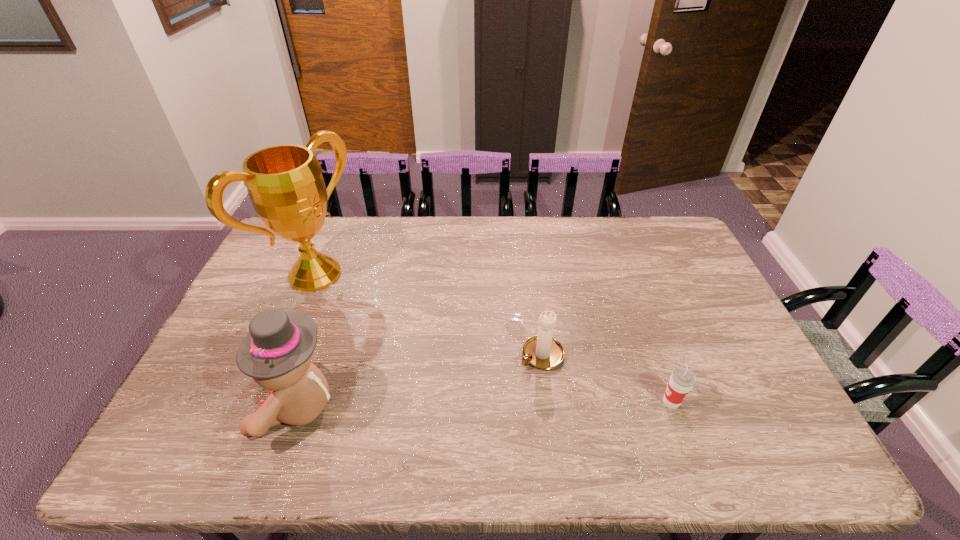
Find the location of a particular element. The height and width of the screenshot is (540, 960). vacant spot on the desktop that is between the rag_doll and the shortest object and is positioned on the front-facing side of the farthest object is located at coordinates (522, 404).

At what (x,y) coordinates should I click in order to perform the action: click on free spot on the desktop that is between the rag_doll and the cup and is positioned on the handle side of the third object from left to right. Please return your answer as a coordinate pair (x, y). The height and width of the screenshot is (540, 960). Looking at the image, I should click on pyautogui.click(x=473, y=404).